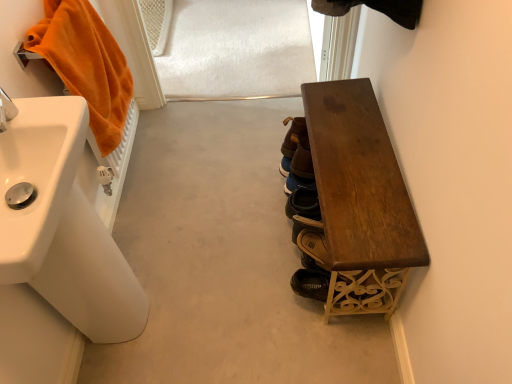
Question: From the image's perspective, is brown leather shoe at center, which is the second footwear in front-to-back order, under orange plush towel at left?

Choices:
 (A) no
 (B) yes

Answer: (B)

Question: Is orange plush towel at left a part of brown leather shoe at center, marked as the 2th footwear in a back-to-front arrangement?

Choices:
 (A) no
 (B) yes

Answer: (A)

Question: Is brown leather shoe at center, the 3th footwear ordered from the bottom, to the left of orange plush towel at left from the viewer's perspective?

Choices:
 (A) no
 (B) yes

Answer: (A)

Question: Is the depth of brown leather shoe at center, which is the first footwear from top to bottom, greater than that of orange plush towel at left?

Choices:
 (A) no
 (B) yes

Answer: (B)

Question: Is brown leather shoe at center, which is the second footwear in front-to-back order, not close to orange plush towel at left?

Choices:
 (A) no
 (B) yes

Answer: (A)

Question: Relative to white glossy sink at left, the 1th sink when ordered from front to back, is dark wood bench at right in front or behind?

Choices:
 (A) behind
 (B) front

Answer: (A)

Question: Considering the positions of dark wood bench at right and white glossy sink at left, the 1th sink when ordered from front to back, in the image, is dark wood bench at right wider or thinner than white glossy sink at left, the 1th sink when ordered from front to back,?

Choices:
 (A) thin
 (B) wide

Answer: (B)

Question: Based on their positions, is dark wood bench at right located to the left or right of white glossy sink at left, which ranks as the 2th sink in back-to-front order?

Choices:
 (A) left
 (B) right

Answer: (B)

Question: From a real-world perspective, relative to white glossy sink at left, the 1th sink when ordered from front to back, is dark wood bench at right vertically above or below?

Choices:
 (A) below
 (B) above

Answer: (A)

Question: Is brown leather shoe at center, which is the first footwear from top to bottom, inside the boundaries of dark wood bench at right, or outside?

Choices:
 (A) outside
 (B) inside

Answer: (B)

Question: Considering the relative positions of brown leather shoe at center, which is the first footwear from top to bottom, and dark wood bench at right in the image provided, is brown leather shoe at center, which is the first footwear from top to bottom, to the left or to the right of dark wood bench at right?

Choices:
 (A) left
 (B) right

Answer: (A)

Question: In terms of size, does brown leather shoe at center, marked as the 2th footwear in a back-to-front arrangement, appear bigger or smaller than dark wood bench at right?

Choices:
 (A) big
 (B) small

Answer: (B)

Question: From the image's perspective, is brown leather shoe at center, which is the first footwear from top to bottom, positioned above or below dark wood bench at right?

Choices:
 (A) above
 (B) below

Answer: (A)

Question: From the image's perspective, is orange plush towel at left positioned above or below dark wood bench at right?

Choices:
 (A) below
 (B) above

Answer: (B)

Question: Choose the correct answer: Is orange plush towel at left inside dark wood bench at right or outside it?

Choices:
 (A) inside
 (B) outside

Answer: (B)